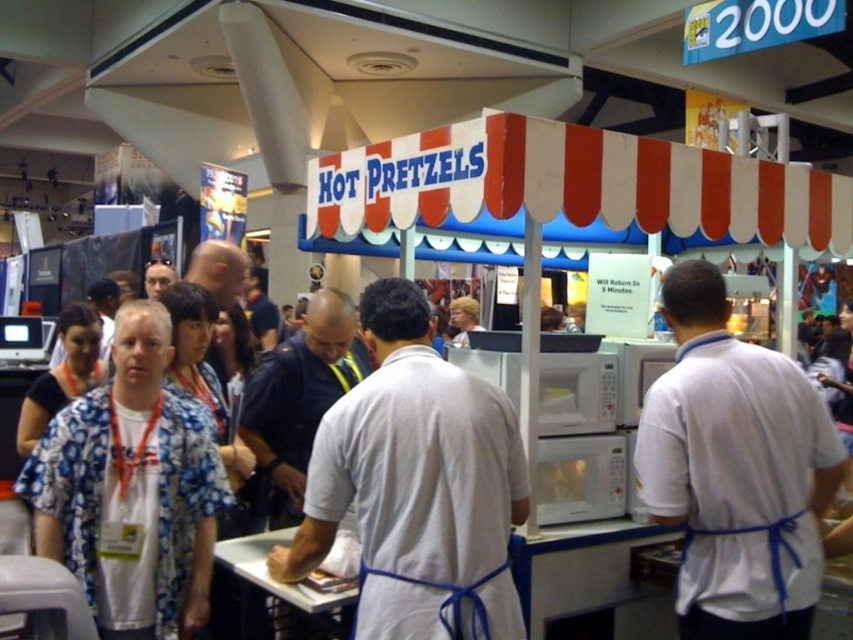
Question: Can you confirm if dark blue uniform at center is smaller than light brown hair at center?

Choices:
 (A) no
 (B) yes

Answer: (A)

Question: Does dark blue uniform at center have a lesser width compared to light brown hair at center?

Choices:
 (A) yes
 (B) no

Answer: (B)

Question: Among these objects, which one is farthest from the camera?

Choices:
 (A) dark blue uniform at center
 (B) floral fabric shirt at left
 (C) light brown hair at center
 (D) white matte shirt at center

Answer: (C)

Question: Is white matte shirt at center closer to camera compared to floral fabric shirt at left?

Choices:
 (A) yes
 (B) no

Answer: (A)

Question: Based on their relative distances, which object is farther from the white matte shirt at center?

Choices:
 (A) white shirt at lower left
 (B) dark blue uniform at center

Answer: (A)

Question: Which object is farther from the camera taking this photo?

Choices:
 (A) white fabric shirt at center
 (B) light brown hair at center
 (C) dark blue uniform at center
 (D) floral fabric shirt at left

Answer: (B)